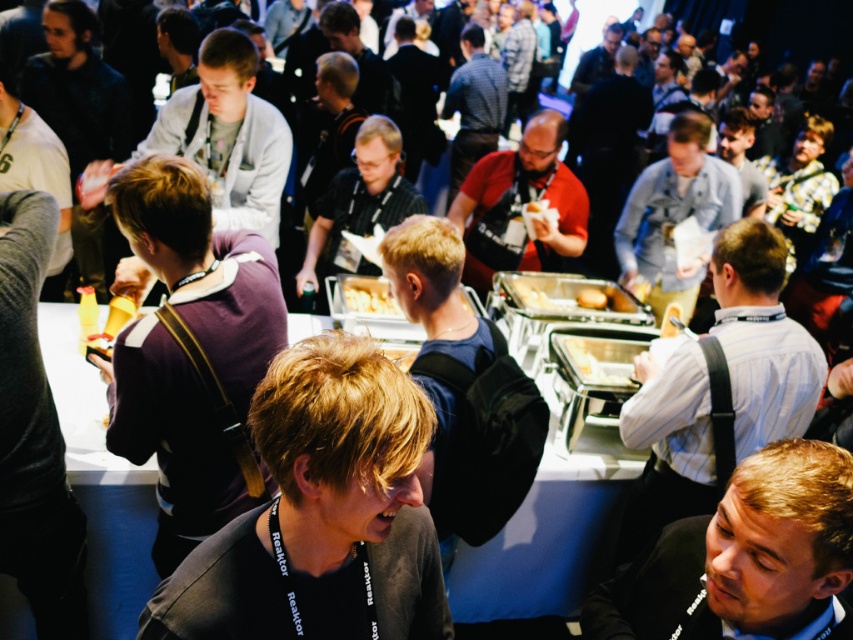
Question: Which point is farther to the camera?

Choices:
 (A) (816, 344)
 (B) (495, 176)
 (C) (247, 321)

Answer: (B)

Question: Which object appears farthest from the camera in this image?

Choices:
 (A) light gray jacket at upper left
 (B) golden brown bread at center
 (C) blue shirt at center
 (D) white shirt at center

Answer: (C)

Question: Is purple soft sweater at center above light brown hair at lower right?

Choices:
 (A) yes
 (B) no

Answer: (A)

Question: Does light gray jacket at upper left appear on the left side of yellow matte bread at center?

Choices:
 (A) yes
 (B) no

Answer: (A)

Question: Among these points, which one is farthest from the camera?

Choices:
 (A) (689, 554)
 (B) (241, 358)

Answer: (B)

Question: Where is light brown leather jacket at center located in relation to golden brown bread at center in the image?

Choices:
 (A) right
 (B) left

Answer: (A)